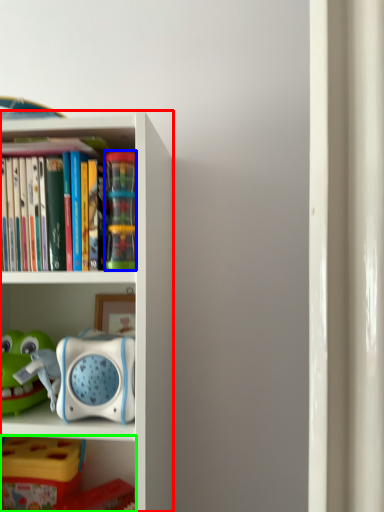
Question: Based on their relative distances, which object is nearer to bookcase (highlighted by a red box)? Choose from toy (highlighted by a blue box) and shelf (highlighted by a green box).

Choices:
 (A) toy
 (B) shelf

Answer: (A)